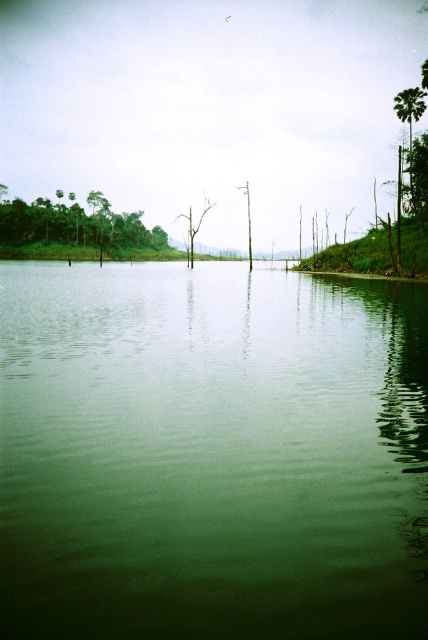
Question: Based on their relative distances, which object is farther from the bare wood tree at center?

Choices:
 (A) green leafy palm tree at upper right
 (B) green leafy trees at upper left
 (C) green smooth water at center

Answer: (C)

Question: Which object is the farthest from the bare wood tree at center?

Choices:
 (A) green leafy trees at upper left
 (B) green smooth water at center
 (C) green leafy palm tree at upper right

Answer: (B)

Question: Where is green smooth water at center located in relation to green leafy palm tree at upper right in the image?

Choices:
 (A) left
 (B) right

Answer: (A)

Question: Is green leafy palm tree at upper right smaller than bare wood tree at center?

Choices:
 (A) no
 (B) yes

Answer: (B)

Question: Which object appears closest to the camera in this image?

Choices:
 (A) green leafy palm tree at upper right
 (B) green smooth water at center

Answer: (B)

Question: Considering the relative positions of green leafy trees at upper left and bare wood tree at center in the image provided, where is green leafy trees at upper left located with respect to bare wood tree at center?

Choices:
 (A) right
 (B) left

Answer: (B)